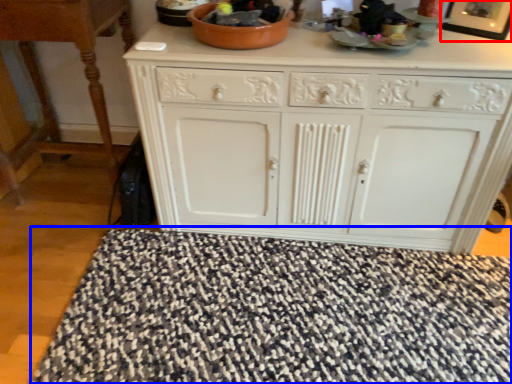
Question: Among these objects, which one is farthest to the camera, picture frame (highlighted by a red box) or doormat (highlighted by a blue box)?

Choices:
 (A) picture frame
 (B) doormat

Answer: (A)